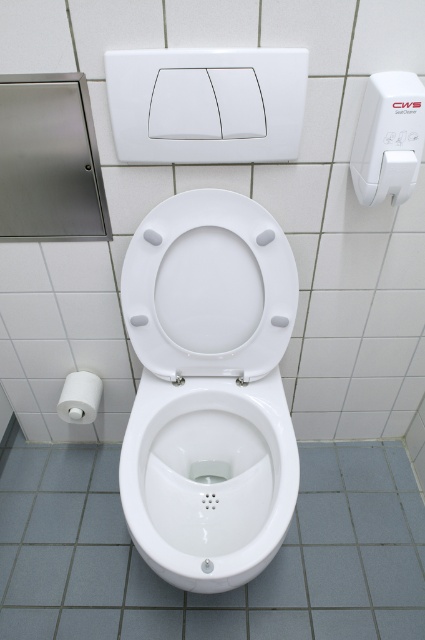
Who is higher up, white glossy toilet bowl at center or white glossy toilet seat at center?

Positioned higher is white glossy toilet seat at center.

Is white glossy toilet bowl at center to the right of white glossy toilet seat at center from the viewer's perspective?

Correct, you'll find white glossy toilet bowl at center to the right of white glossy toilet seat at center.

You are a GUI agent. You are given a task and a screenshot of the screen. Output one action in this format:
    pyautogui.click(x=<x>, y=<y>)
    Task: Click on the white glossy toilet bowl at center
    
    Given the screenshot: What is the action you would take?
    pyautogui.click(x=209, y=484)

I want to click on white glossy toilet at center, so click(212, 593).

Which of these two, white glossy toilet at center or white matte toilet paper at lower left, stands taller?

white glossy toilet at center is taller.

The width and height of the screenshot is (425, 640). Describe the element at coordinates (212, 593) in the screenshot. I see `white glossy toilet at center` at that location.

At what (x,y) coordinates should I click in order to perform the action: click on white glossy toilet at center. Please return your answer as a coordinate pair (x, y). This screenshot has height=640, width=425. Looking at the image, I should click on pyautogui.click(x=212, y=593).

Which of these two, white glossy toilet at center or white glossy toilet seat at center, stands taller?

white glossy toilet at center is taller.

Who is more forward, (22, 595) or (280, 352)?

Positioned in front is point (280, 352).

This screenshot has height=640, width=425. I want to click on white glossy toilet at center, so click(x=212, y=593).

Image resolution: width=425 pixels, height=640 pixels. I want to click on white glossy toilet at center, so click(x=212, y=593).